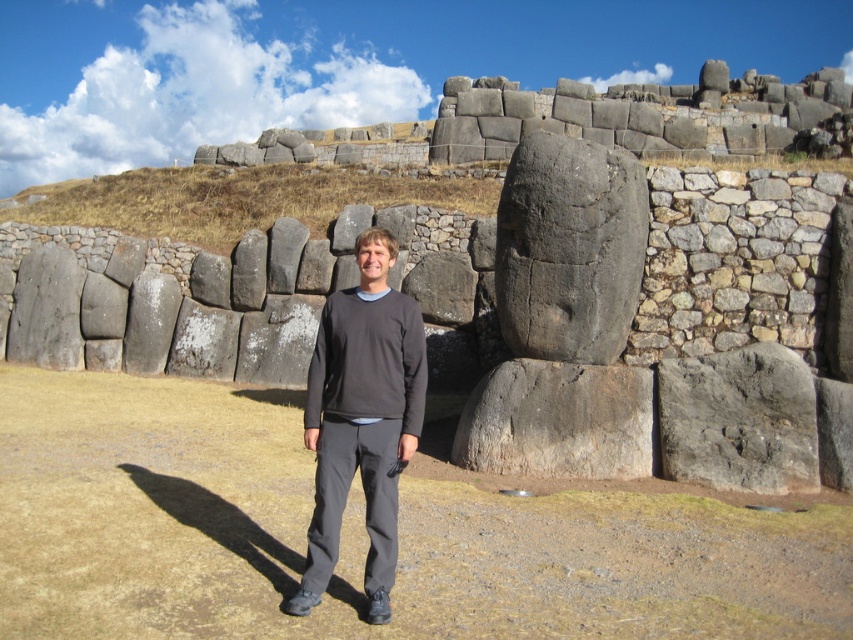
Consider the image. You are an archaeologist examining the scene. You need to determine which object is narrower between the dark gray sweater at center and the gray rough stone boulder at center. Which one is it?

The dark gray sweater at center is narrower than the gray rough stone boulder at center.

You are an archaeologist examining the ancient stone structure. You notice the gray stone carving at center and the dark gray fleece sweatshirt at center. Which object is narrower in width?

→ The gray stone carving at center has a lesser width compared to the dark gray fleece sweatshirt at center, so the gray stone carving at center is narrower in width.

You are an archaeologist examining the ancient stone structures. You notice two gray stones in the center of the image. Which one is closer to you, the gray stone carving at center or the gray rough stone boulder at center?

The gray stone carving at center is closer to you because it is further to the viewer than the gray rough stone boulder at center.